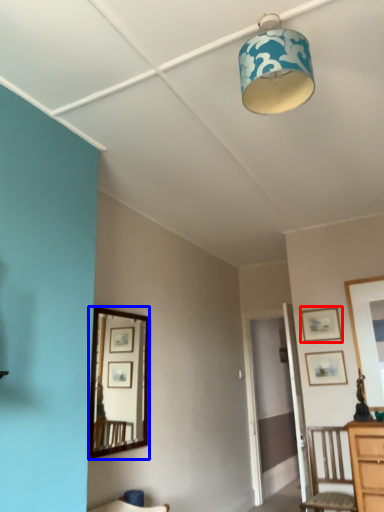
Question: Which object appears closest to the camera in this image, picture frame (highlighted by a red box) or mirror (highlighted by a blue box)?

Choices:
 (A) picture frame
 (B) mirror

Answer: (B)